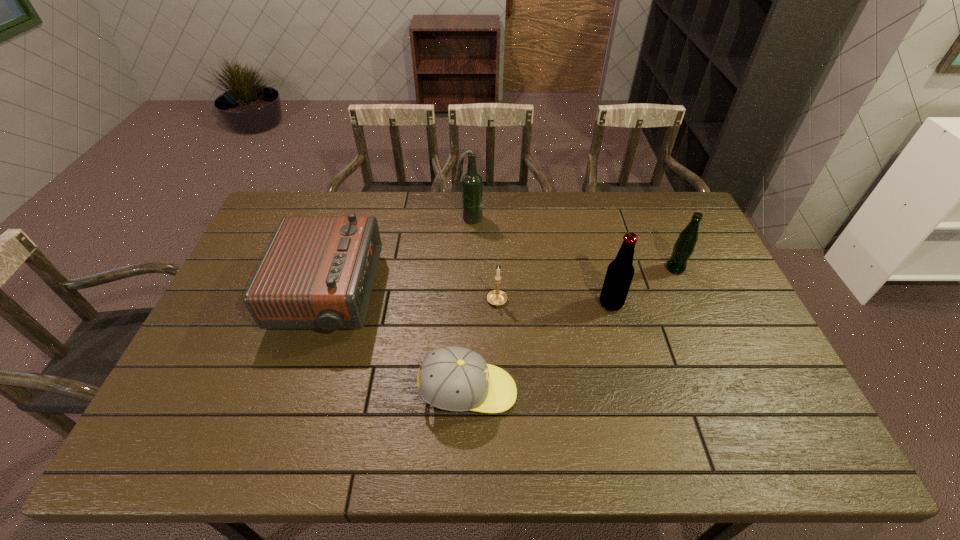
In the image, there is a desktop. Identify the location of blank space at the right edge. The width and height of the screenshot is (960, 540). [x=724, y=381].

Find the location of a particular element. The image size is (960, 540). blank area at the far left corner is located at coordinates point(307,205).

This screenshot has width=960, height=540. I want to click on free space at the far right corner, so click(x=670, y=193).

Find the location of a particular element. vacant area between the nearest beer bottle and the radio receiver is located at coordinates (469, 299).

This screenshot has height=540, width=960. What are the coordinates of `free area in between the candle holder and the radio receiver` in the screenshot? It's located at (413, 299).

Identify the location of free point between the baseball cap and the nearest beer bottle. (540, 348).

I want to click on unoccupied area between the rightmost object and the candle holder, so click(x=586, y=285).

This screenshot has height=540, width=960. Identify the location of free spot between the candle holder and the farthest beer bottle. (483, 260).

Where is `free space between the candle holder and the baseball cap`? This screenshot has width=960, height=540. free space between the candle holder and the baseball cap is located at coordinates (483, 347).

This screenshot has width=960, height=540. Find the location of `blank region between the candle holder and the leftmost beer bottle`. blank region between the candle holder and the leftmost beer bottle is located at coordinates (483, 260).